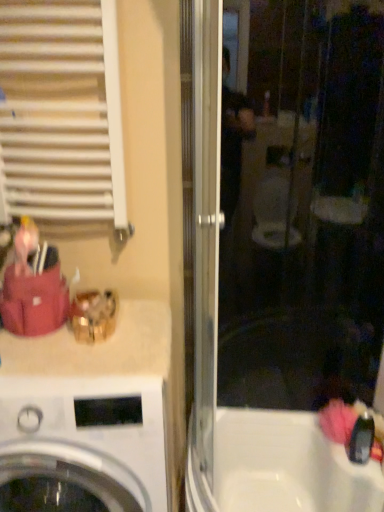
Question: Is transparent glass screen door at center facing towards white matte radiator at upper left?

Choices:
 (A) yes
 (B) no

Answer: (B)

Question: From a real-world perspective, is transparent glass screen door at center under white matte radiator at upper left?

Choices:
 (A) yes
 (B) no

Answer: (A)

Question: Is transparent glass screen door at center taller than white matte radiator at upper left?

Choices:
 (A) yes
 (B) no

Answer: (A)

Question: Does transparent glass screen door at center lie in front of white matte radiator at upper left?

Choices:
 (A) no
 (B) yes

Answer: (B)

Question: Does transparent glass screen door at center contain white matte radiator at upper left?

Choices:
 (A) no
 (B) yes

Answer: (A)

Question: From a real-world perspective, is white matte radiator at upper left positioned above or below white glossy washing machine at lower left?

Choices:
 (A) below
 (B) above

Answer: (B)

Question: Is white matte radiator at upper left to the left or to the right of white glossy washing machine at lower left in the image?

Choices:
 (A) right
 (B) left

Answer: (B)

Question: In terms of width, does white matte radiator at upper left look wider or thinner when compared to white glossy washing machine at lower left?

Choices:
 (A) thin
 (B) wide

Answer: (A)

Question: From the image's perspective, relative to white glossy washing machine at lower left, is white matte radiator at upper left above or below?

Choices:
 (A) above
 (B) below

Answer: (A)

Question: Considering the relative positions of white glossy bathtub at lower right and transparent glass screen door at center in the image provided, is white glossy bathtub at lower right to the left or to the right of transparent glass screen door at center?

Choices:
 (A) right
 (B) left

Answer: (B)

Question: Looking at the image, does white glossy bathtub at lower right seem bigger or smaller compared to transparent glass screen door at center?

Choices:
 (A) small
 (B) big

Answer: (A)

Question: From their relative heights in the image, would you say white glossy bathtub at lower right is taller or shorter than transparent glass screen door at center?

Choices:
 (A) short
 (B) tall

Answer: (A)

Question: Considering the positions of point (200, 483) and point (236, 479), is point (200, 483) closer or farther from the camera than point (236, 479)?

Choices:
 (A) closer
 (B) farther

Answer: (A)

Question: From a real-world perspective, is white glossy washing machine at lower left positioned above or below white glossy bathtub at lower right?

Choices:
 (A) above
 (B) below

Answer: (A)

Question: In terms of size, does white glossy washing machine at lower left appear bigger or smaller than white glossy bathtub at lower right?

Choices:
 (A) big
 (B) small

Answer: (A)